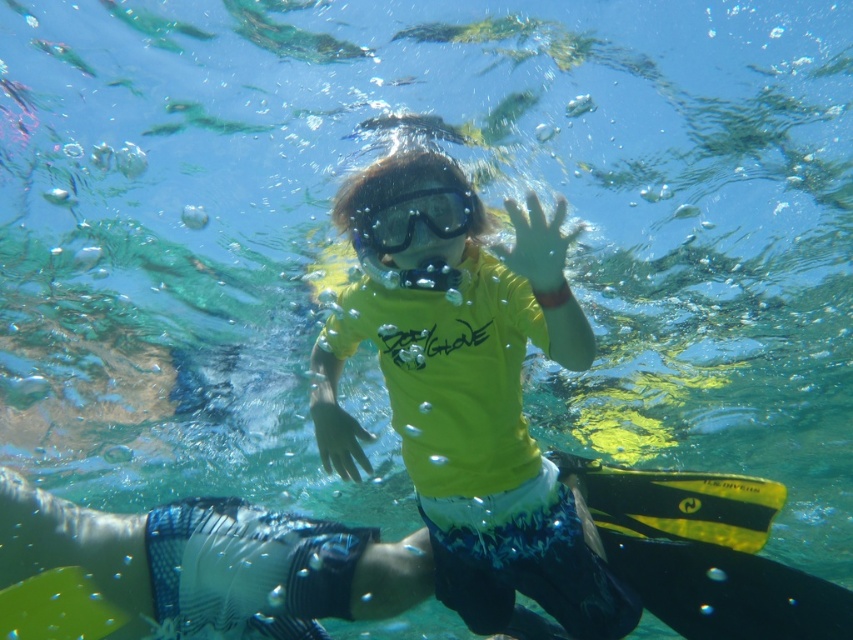
You are a lifeguard trying to locate a specific point in the water. The coordinates given are point (468,392). Based on the snorkeler in the image, where would this point be located?

The point (468,392) is on the yellow matte shirt at center of the snorkeler.

You are a marine biologist observing the snorkeler. You need to determine which item is nearer to you between the yellow matte shirt at center and the transparent plastic goggles at center. Which one is closer?

The yellow matte shirt at center is closer to the viewer than the transparent plastic goggles at center.

You are a snorkeler who wants to adjust your gear. You need to reach the transparent plastic goggles at center. Can you do so without moving the yellow matte shirt at center?

The yellow matte shirt at center is located below transparent plastic goggles at center, so you can reach the transparent plastic goggles at center without moving the yellow matte shirt at center because it is positioned above.